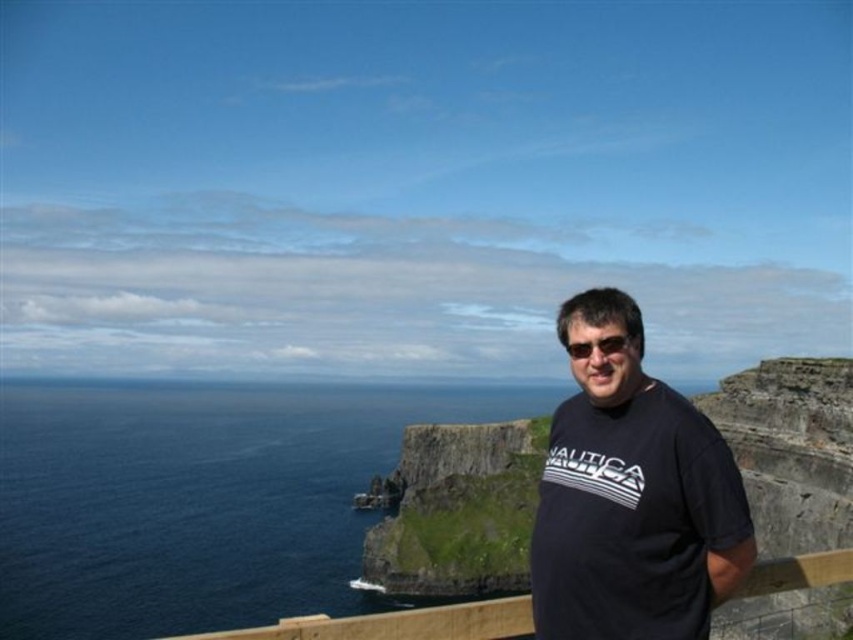
Question: Is black cotton t-shirt at center closer to camera compared to black plastic sunglasses at center?

Choices:
 (A) no
 (B) yes

Answer: (B)

Question: Among these points, which one is farthest from the camera?

Choices:
 (A) (529, 609)
 (B) (578, 352)
 (C) (726, 422)
 (D) (590, 356)

Answer: (C)

Question: Does black cotton t-shirt at center appear over black plastic sunglasses at center?

Choices:
 (A) no
 (B) yes

Answer: (A)

Question: Estimate the real-world distances between objects in this image. Which object is farther from the brown wooden rail at lower center?

Choices:
 (A) black plastic sunglasses at center
 (B) green mossy rock at center

Answer: (B)

Question: Which of the following is the farthest from the observer?

Choices:
 (A) black cotton t-shirt at center
 (B) green mossy rock at center
 (C) brown wooden rail at lower center
 (D) black plastic sunglasses at center

Answer: (B)

Question: Does green mossy rock at center have a larger size compared to brown wooden rail at lower center?

Choices:
 (A) no
 (B) yes

Answer: (B)